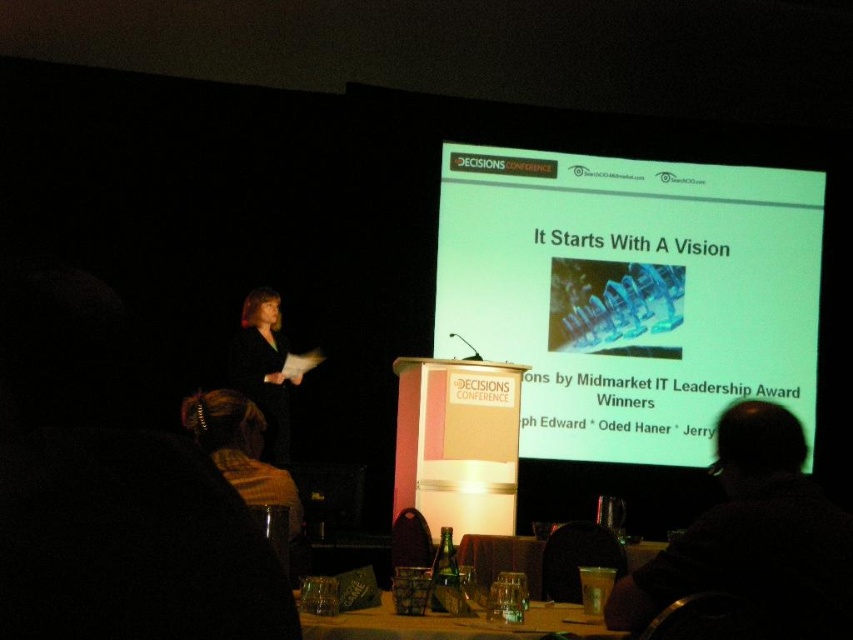
Question: Observing the image, what is the correct spatial positioning of black fabric at left in reference to translucent glass table at lower center?

Choices:
 (A) above
 (B) below

Answer: (A)

Question: Where is dark hair at upper right located in relation to matte black dress at left in the image?

Choices:
 (A) right
 (B) left

Answer: (A)

Question: Does green matte projector screen at upper center have a lesser width compared to translucent glass table at lower center?

Choices:
 (A) no
 (B) yes

Answer: (A)

Question: Which object is the farthest from the translucent glass table at center?

Choices:
 (A) dark hair at upper right
 (B) matte black dress at left
 (C) green matte projector screen at upper center
 (D) black fabric at left

Answer: (C)

Question: Estimate the real-world distances between objects in this image. Which object is farther from the matte black dress at left?

Choices:
 (A) dark hair at upper right
 (B) translucent glass table at center

Answer: (A)

Question: Which object is farther from the camera taking this photo?

Choices:
 (A) brown knitted scarf at lower center
 (B) green matte projector screen at upper center
 (C) translucent glass table at lower center
 (D) matte black dress at left

Answer: (B)